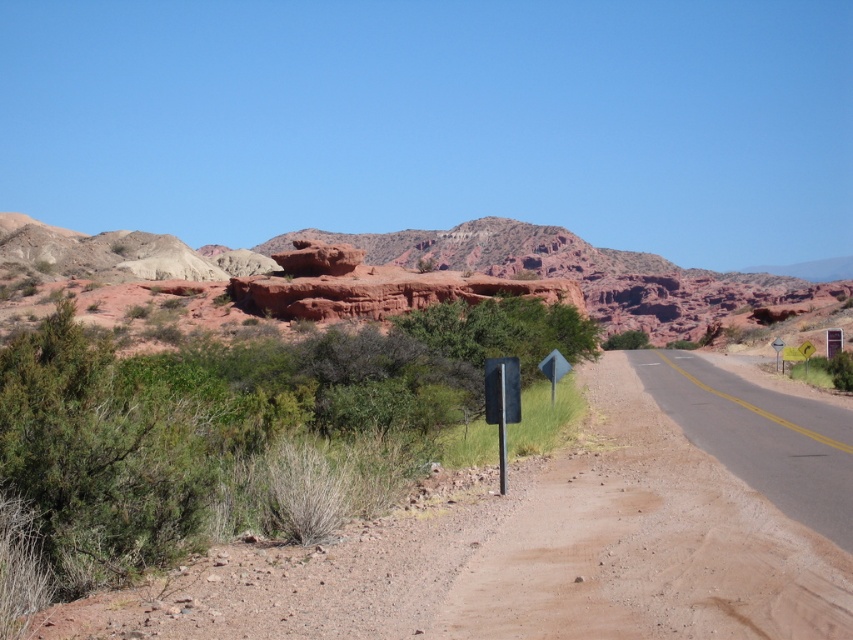
Who is positioned more to the right, brown gravel dirt track at center or black metal sign at center?

Positioned to the right is brown gravel dirt track at center.

Who is more distant from viewer, (x=656, y=428) or (x=514, y=420)?

The point (x=656, y=428) is more distant.

Find the location of a particular element. brown gravel dirt track at center is located at coordinates (646, 544).

This screenshot has height=640, width=853. What do you see at coordinates (444, 268) in the screenshot?
I see `reddish rock formation at center` at bounding box center [444, 268].

Which is in front, point (270, 262) or point (776, 339)?

Positioned in front is point (776, 339).

Locate an element on the screen. reddish rock formation at center is located at coordinates (444, 268).

Is brown gravel dirt track at center above reddish rock formation at center?

Incorrect, brown gravel dirt track at center is not positioned above reddish rock formation at center.

In the scene shown: Which is below, brown gravel dirt track at center or reddish rock formation at center?

brown gravel dirt track at center is below.

Is point (740, 496) in front of point (756, 292)?

Yes, it is in front of point (756, 292).

Identify the location of brown gravel dirt track at center. (646, 544).